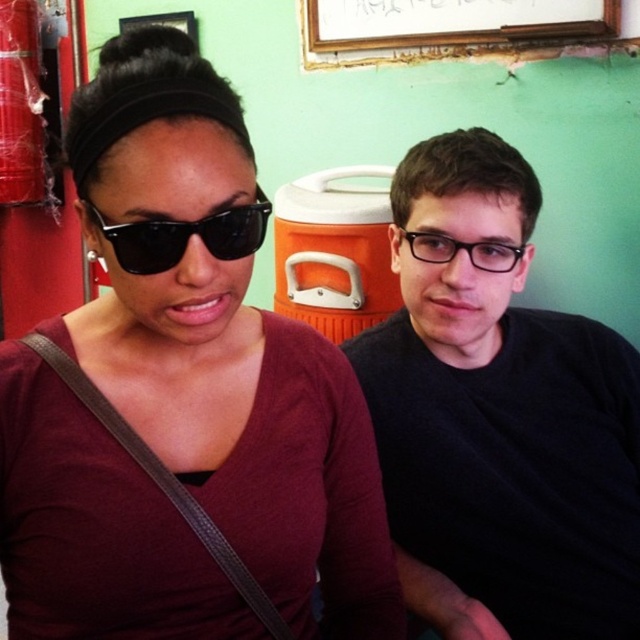
Does matte black sunglasses at upper left lie in front of black plastic sunglasses at left?

Yes.

From the picture: Who is more forward, (234, 220) or (248, 225)?

Point (234, 220)

The height and width of the screenshot is (640, 640). I want to click on matte black sunglasses at upper left, so click(182, 397).

Is wooden frame at upper center thinner than black plastic sunglasses at left?

No, wooden frame at upper center is not thinner than black plastic sunglasses at left.

Between point (397, 33) and point (259, 192), which one is positioned behind?

The point (397, 33) is more distant.

The height and width of the screenshot is (640, 640). I want to click on wooden frame at upper center, so click(x=460, y=29).

Between matte black sunglasses at upper left and wooden frame at upper center, which one appears on the right side from the viewer's perspective?

From the viewer's perspective, wooden frame at upper center appears more on the right side.

Where is `matte black sunglasses at upper left`? The height and width of the screenshot is (640, 640). matte black sunglasses at upper left is located at coordinates (182, 397).